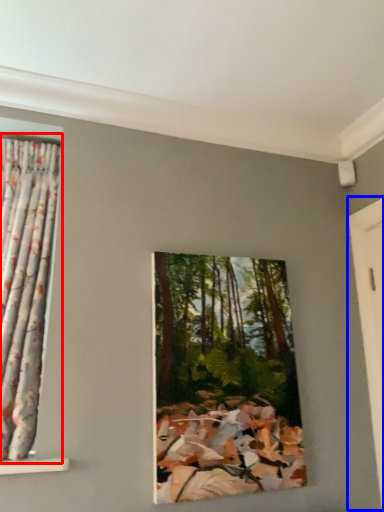
Question: Which object appears closest to the camera in this image, curtain (highlighted by a red box) or door (highlighted by a blue box)?

Choices:
 (A) curtain
 (B) door

Answer: (A)